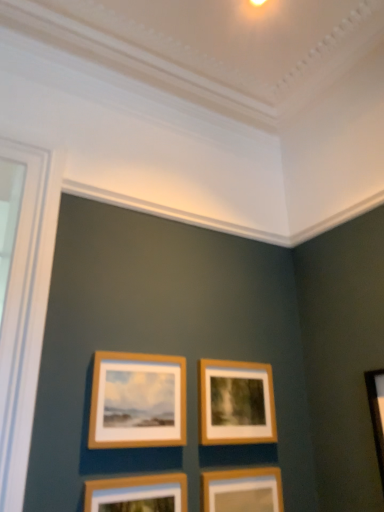
Question: From the image's perspective, does wooden frame at center, placed as the fourth picture frame when sorted from bottom to top, appear lower than wooden picture frame at lower center, which is the 4th picture frame from top to bottom?

Choices:
 (A) no
 (B) yes

Answer: (A)

Question: Considering the relative positions of wooden frame at center, which ranks as the first picture frame in top-to-bottom order, and wooden picture frame at lower center, which is the 4th picture frame from top to bottom, in the image provided, is wooden frame at center, which ranks as the first picture frame in top-to-bottom order, to the left of wooden picture frame at lower center, which is the 4th picture frame from top to bottom, from the viewer's perspective?

Choices:
 (A) yes
 (B) no

Answer: (A)

Question: Would you consider wooden frame at center, which ranks as the first picture frame in top-to-bottom order, to be distant from wooden picture frame at lower center, which is counted as the 1th picture frame, starting from the bottom?

Choices:
 (A) yes
 (B) no

Answer: (B)

Question: Can you confirm if wooden frame at center, placed as the fourth picture frame when sorted from bottom to top, is shorter than wooden picture frame at lower center, which is counted as the 1th picture frame, starting from the bottom?

Choices:
 (A) yes
 (B) no

Answer: (B)

Question: From a real-world perspective, is wooden frame at center, which ranks as the first picture frame in top-to-bottom order, on wooden picture frame at lower center, which is the 4th picture frame from top to bottom?

Choices:
 (A) no
 (B) yes

Answer: (B)

Question: From the image's perspective, is wooden frame at center, which ranks as the first picture frame in top-to-bottom order, on wooden picture frame at lower center, which is the 4th picture frame from top to bottom?

Choices:
 (A) no
 (B) yes

Answer: (B)

Question: Can you confirm if wooden picture frame at lower center, which ranks as the 2th picture frame in bottom-to-top order, is thinner than wooden frame at center, placed as the fourth picture frame when sorted from bottom to top?

Choices:
 (A) no
 (B) yes

Answer: (A)

Question: Is wooden picture frame at lower center, the third picture frame when ordered from top to bottom, smaller than wooden frame at center, which ranks as the first picture frame in top-to-bottom order?

Choices:
 (A) no
 (B) yes

Answer: (A)

Question: Can you confirm if wooden picture frame at lower center, which ranks as the 2th picture frame in bottom-to-top order, is wider than wooden frame at center, placed as the fourth picture frame when sorted from bottom to top?

Choices:
 (A) yes
 (B) no

Answer: (A)

Question: Does wooden picture frame at lower center, the third picture frame when ordered from top to bottom, have a greater height compared to wooden frame at center, which ranks as the first picture frame in top-to-bottom order?

Choices:
 (A) yes
 (B) no

Answer: (B)

Question: From the image's perspective, is wooden picture frame at lower center, the third picture frame when ordered from top to bottom, over wooden frame at center, placed as the fourth picture frame when sorted from bottom to top?

Choices:
 (A) yes
 (B) no

Answer: (B)

Question: Could you tell me if wooden picture frame at lower center, the third picture frame when ordered from top to bottom, is turned towards wooden frame at center, which ranks as the first picture frame in top-to-bottom order?

Choices:
 (A) no
 (B) yes

Answer: (A)

Question: Does wooden frame at center, which is the third picture frame from bottom to top, have a greater height compared to wooden picture frame at lower center, which is counted as the 1th picture frame, starting from the bottom?

Choices:
 (A) yes
 (B) no

Answer: (B)